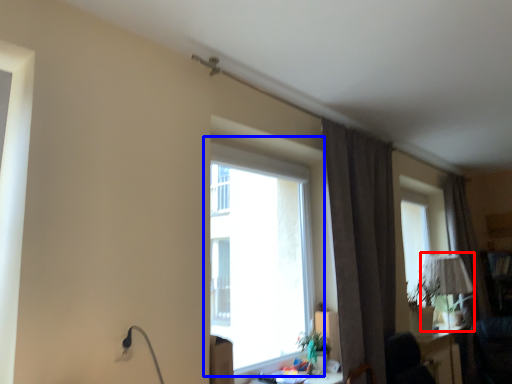
Question: Which point is further to the camera, table lamp (highlighted by a red box) or window (highlighted by a blue box)?

Choices:
 (A) table lamp
 (B) window

Answer: (A)